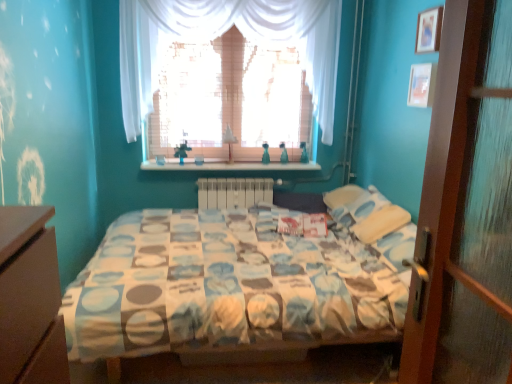
Question: Considering the relative sizes of white plastic radiator at center and white sheer curtain at upper center in the image provided, is white plastic radiator at center bigger than white sheer curtain at upper center?

Choices:
 (A) no
 (B) yes

Answer: (A)

Question: Is white plastic radiator at center not inside white sheer curtain at upper center?

Choices:
 (A) yes
 (B) no

Answer: (A)

Question: Considering the relative sizes of white plastic radiator at center and white sheer curtain at upper center in the image provided, is white plastic radiator at center thinner than white sheer curtain at upper center?

Choices:
 (A) yes
 (B) no

Answer: (A)

Question: From the image's perspective, is white plastic radiator at center on white sheer curtain at upper center?

Choices:
 (A) no
 (B) yes

Answer: (A)

Question: Is white plastic radiator at center wider than white sheer curtain at upper center?

Choices:
 (A) no
 (B) yes

Answer: (A)

Question: Is white plastic radiator at center not near white sheer curtain at upper center?

Choices:
 (A) yes
 (B) no

Answer: (B)

Question: Is wooden picture frame at upper right, the 2th picture frame positioned from the top, thinner than white plastic radiator at center?

Choices:
 (A) yes
 (B) no

Answer: (A)

Question: Considering the relative sizes of wooden picture frame at upper right, the 2th picture frame positioned from the top, and white plastic radiator at center in the image provided, is wooden picture frame at upper right, the 2th picture frame positioned from the top, bigger than white plastic radiator at center?

Choices:
 (A) no
 (B) yes

Answer: (A)

Question: From the image's perspective, is wooden picture frame at upper right, the 2th picture frame positioned from the top, beneath white plastic radiator at center?

Choices:
 (A) yes
 (B) no

Answer: (B)

Question: Is wooden picture frame at upper right, the 1th picture frame when ordered from bottom to top, smaller than white plastic radiator at center?

Choices:
 (A) no
 (B) yes

Answer: (B)

Question: Is wooden picture frame at upper right, the 1th picture frame when ordered from bottom to top, oriented towards white plastic radiator at center?

Choices:
 (A) no
 (B) yes

Answer: (A)

Question: From the image's perspective, is wooden picture frame at upper right, the 2th picture frame positioned from the top, above white plastic radiator at center?

Choices:
 (A) no
 (B) yes

Answer: (B)

Question: From the image's perspective, is wooden shelf at center over wooden picture frame at upper right, the 2th picture frame positioned from the top?

Choices:
 (A) no
 (B) yes

Answer: (A)